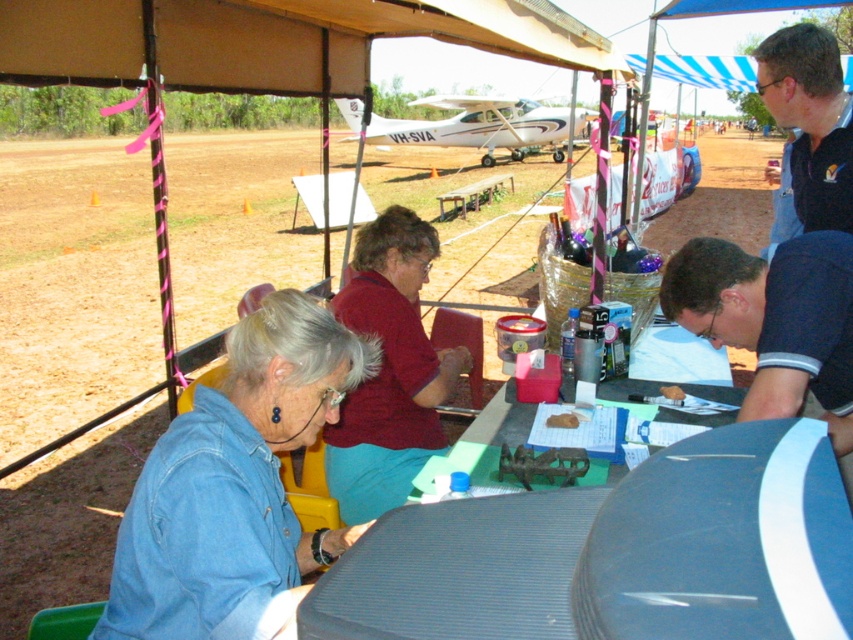
You are standing at point (546, 424) and want to walk to the aircraft marked VH_SVA. Is the point (386, 234) between you and the aircraft?

Point (386, 234) is behind point (546, 424), so it is not between you and the aircraft. You can walk directly to the aircraft without encountering the point (386, 234) along your path.